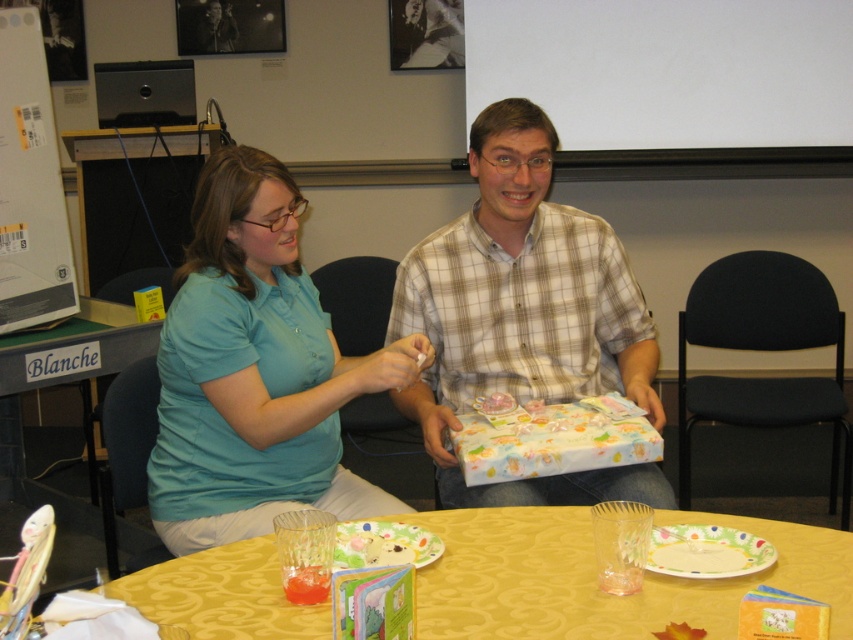
Does teal shirt at left have a lesser height compared to yellow fabric table at lower center?

In fact, teal shirt at left may be taller than yellow fabric table at lower center.

From the picture: Who is more distant from viewer, (206,205) or (91,486)?

The point (91,486) is more distant.

In order to click on teal shirt at left in this screenshot , I will do `click(254, 371)`.

Does point (164, 516) come behind point (479, 204)?

That is False.

Consider the image. Is teal shirt at left to the left of plaid shirt at center from the viewer's perspective?

Correct, you'll find teal shirt at left to the left of plaid shirt at center.

Find the location of a particular element. This screenshot has width=853, height=640. teal shirt at left is located at coordinates (254, 371).

Is point (480, 540) positioned in front of point (20, 476)?

That is True.

Does yellow fabric table at center appear on the left side of yellow fabric table at lower center?

Incorrect, yellow fabric table at center is not on the left side of yellow fabric table at lower center.

The height and width of the screenshot is (640, 853). Find the location of `yellow fabric table at center`. yellow fabric table at center is located at coordinates (596, 580).

The width and height of the screenshot is (853, 640). Identify the location of yellow fabric table at center. (596, 580).